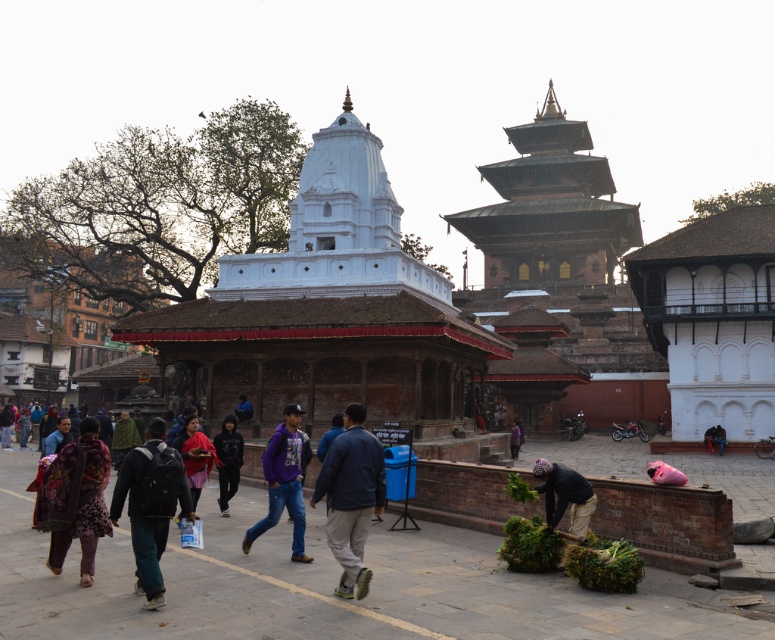
Question: Which point is closer to the camera?

Choices:
 (A) (183, 477)
 (B) (264, 531)
 (C) (188, 440)

Answer: (A)

Question: Is black cotton hoodie at center thinner than purple fabric at center?

Choices:
 (A) no
 (B) yes

Answer: (B)

Question: Which point is farther to the camera?

Choices:
 (A) dark green backpack at center
 (B) floral fabric bag at center

Answer: (B)

Question: Observing the image, what is the correct spatial positioning of floral fabric bag at center in reference to blue fabric at center?

Choices:
 (A) above
 (B) below

Answer: (A)

Question: Considering the real-world distances, which object is farthest from the blue denim jacket at center?

Choices:
 (A) red fabric shawl at center
 (B) purple fabric at center
 (C) dark green backpack at center
 (D) purple fleece jacket at center

Answer: (B)

Question: Does red fabric shawl at center appear on the right side of blue fabric at center?

Choices:
 (A) yes
 (B) no

Answer: (A)